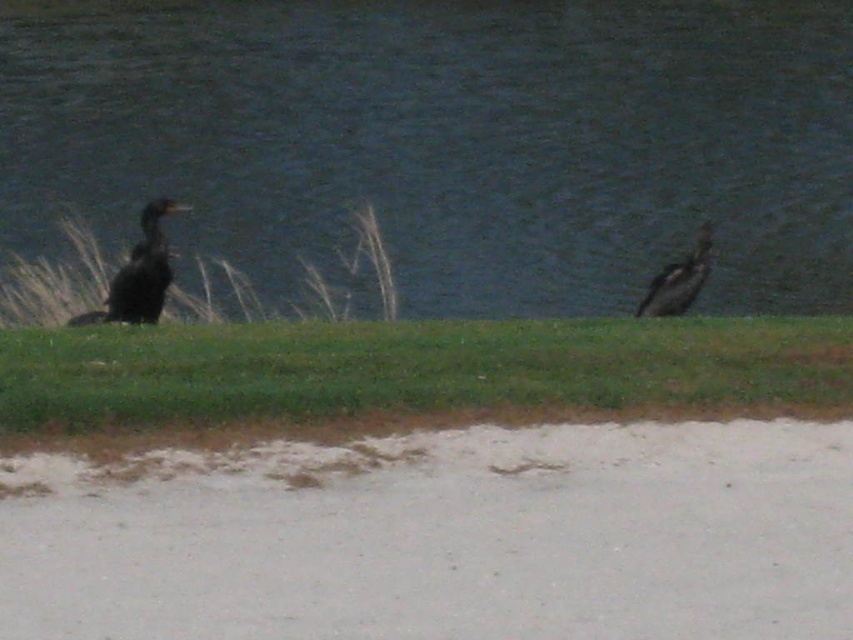
You are a birdwatcher observing two sets of dark brown feathers at left and dark brown feathers at right on the sandy beach. Which set of dark brown feathers has a greater width?

The dark brown feathers at left has a greater width than the dark brown feathers at right.

In the scene shown: You are a birdwatcher standing on the sandy area in the foreground. You see two sets of dark brown feathers at left and dark brown feathers at right. Which set of feathers is closer to the water?

The dark brown feathers at right are closer to the water because they are positioned to the right of the dark brown feathers at left, and since the water is in the mid to background, the right side feathers are nearer to it.